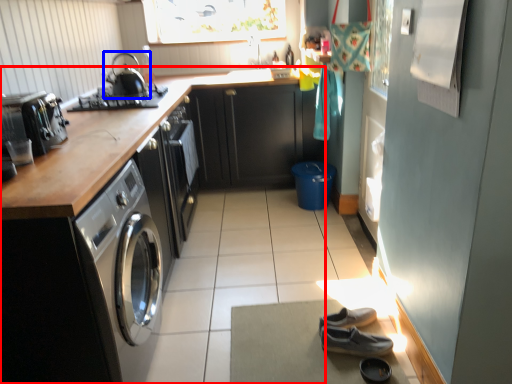
Question: Among these objects, which one is farthest to the camera, cabinetry (highlighted by a red box) or kitchen appliance (highlighted by a blue box)?

Choices:
 (A) cabinetry
 (B) kitchen appliance

Answer: (B)